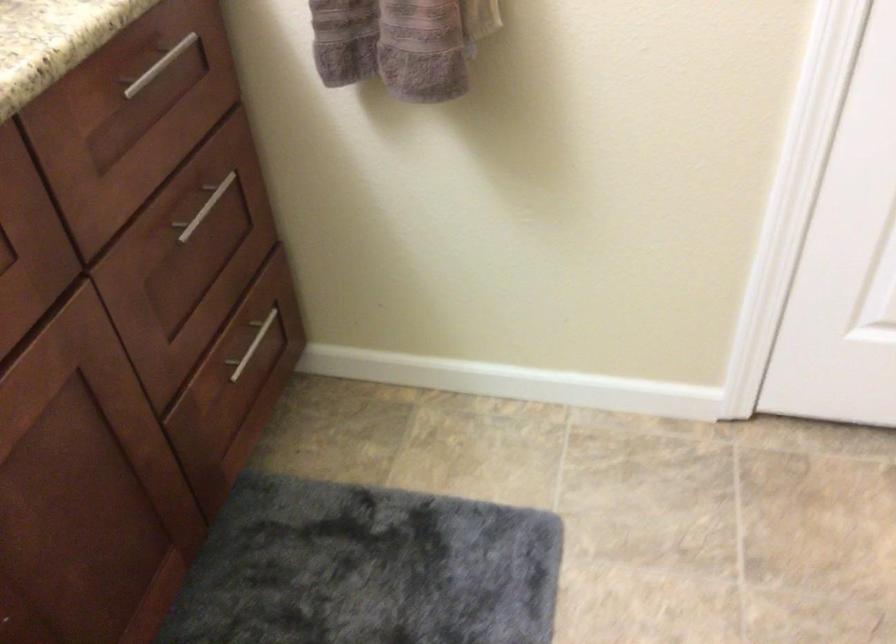
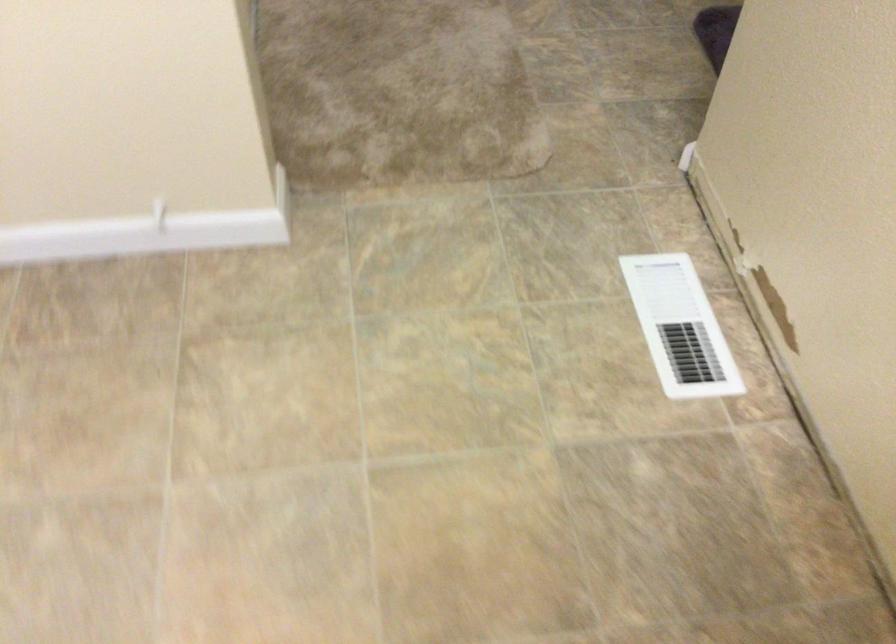
How did the camera likely rotate?

The rotation direction of the camera is right-down.